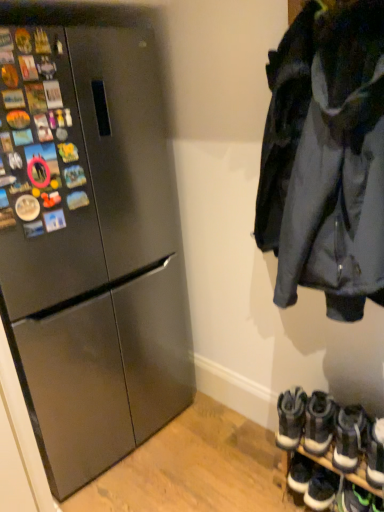
Question: Is point (327, 445) positioned closer to the camera than point (271, 156)?

Choices:
 (A) farther
 (B) closer

Answer: (A)

Question: Considering their positions, is white leather sneakers at lower right, the sixth footwear positioned from the right, located in front of or behind dark gray fabric jacket at upper right?

Choices:
 (A) front
 (B) behind

Answer: (B)

Question: Considering the real-world distances, which object is closest to the white synthetic sneakers at lower right, the fourth footwear positioned from the right?

Choices:
 (A) white rubber sneakers at lower right, which is counted as the 3th footwear, starting from the right
 (B) dark gray fabric jacket at upper right
 (C) satin black refrigerator at left
 (D) green suede sneakers at lower right, placed as the 2th footwear when sorted from right to left
 (E) white suede sneakers at lower right, which is the first footwear in right-to-left order

Answer: (E)

Question: Which object is positioned farthest from the satin black refrigerator at left?

Choices:
 (A) white leather sneakers at lower right, the 2th footwear from the left
 (B) dark gray fabric jacket at upper right
 (C) green suede sneakers at lower right, placed as the 2th footwear when sorted from right to left
 (D) white suede sneakers at lower right, positioned as the seventh footwear in left-to-right order
 (E) white rubber sneakers at lower right, which is counted as the 3th footwear, starting from the right

Answer: (C)